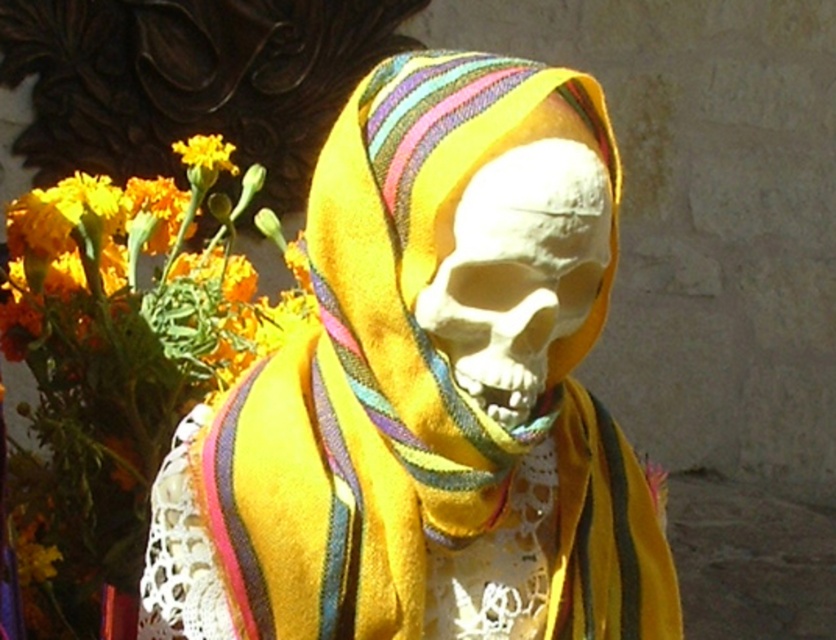
Question: Which point is closer to the camera taking this photo?

Choices:
 (A) (339, 276)
 (B) (539, 348)
 (C) (225, 145)

Answer: (B)

Question: Is yellow fabric skull at center wider than white matte skull at center?

Choices:
 (A) no
 (B) yes

Answer: (B)

Question: Can you confirm if white matte skull at center is bigger than yellow fabric flower at upper left?

Choices:
 (A) no
 (B) yes

Answer: (B)

Question: Observing the image, what is the correct spatial positioning of yellow fabric skull at center in reference to yellow fabric flower at upper left?

Choices:
 (A) below
 (B) above

Answer: (A)

Question: Which point is farther to the camera?

Choices:
 (A) (482, 234)
 (B) (493, 58)

Answer: (B)

Question: Which point is closer to the camera?

Choices:
 (A) yellow fabric skull at center
 (B) yellow fabric flower at upper left
 (C) white matte skull at center

Answer: (A)